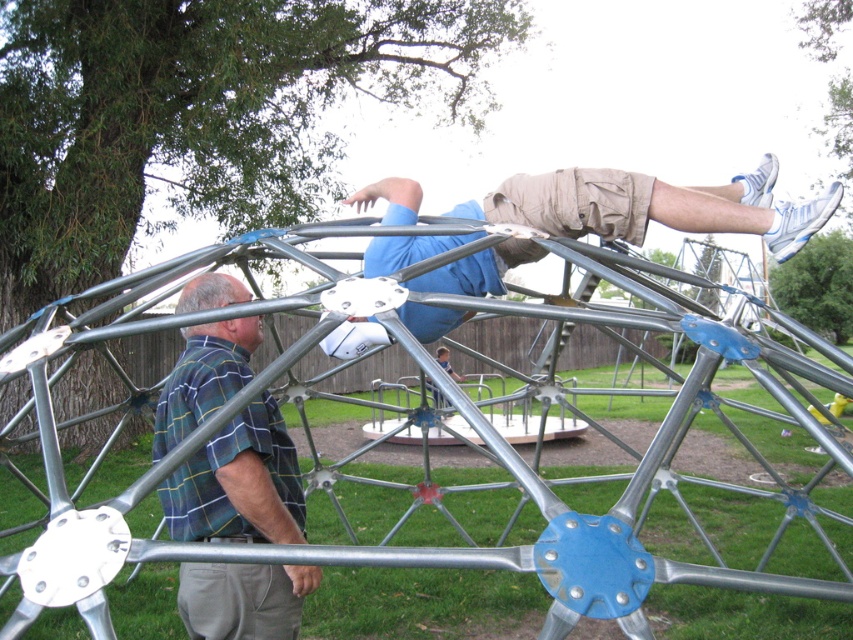
Question: Does green plaid shirt at left appear on the right side of light brown fabric shorts at upper center?

Choices:
 (A) yes
 (B) no

Answer: (B)

Question: Among these points, which one is farthest from the camera?

Choices:
 (A) (241, 538)
 (B) (706, 227)

Answer: (B)

Question: Can you confirm if green plaid shirt at left is thinner than light brown fabric shorts at upper center?

Choices:
 (A) yes
 (B) no

Answer: (A)

Question: Can you confirm if green plaid shirt at left is wider than light brown fabric shorts at upper center?

Choices:
 (A) no
 (B) yes

Answer: (A)

Question: Among these objects, which one is farthest from the camera?

Choices:
 (A) light brown fabric shorts at upper center
 (B) green plaid shirt at left

Answer: (A)

Question: Which point appears farthest from the camera in this image?

Choices:
 (A) (178, 536)
 (B) (466, 316)

Answer: (B)